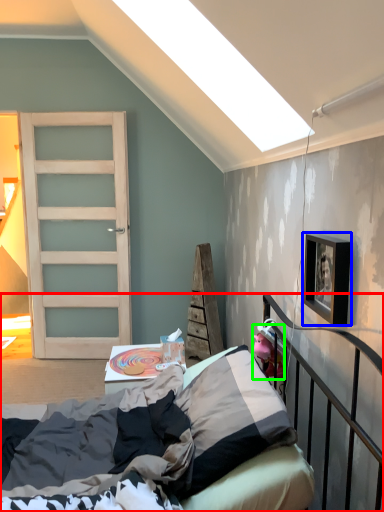
Question: Estimate the real-world distances between objects in this image. Which object is farther from bed (highlighted by a red box), picture frame (highlighted by a blue box) or toy (highlighted by a green box)?

Choices:
 (A) picture frame
 (B) toy

Answer: (A)